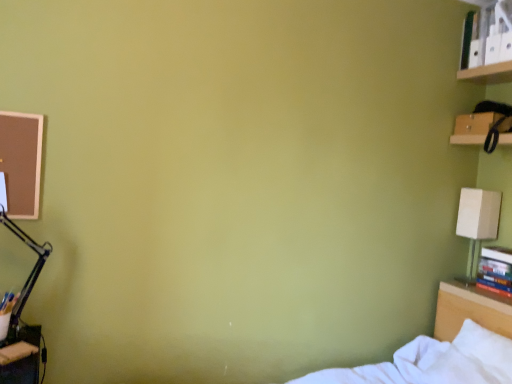
Question: Is white soft bed at lower right far away from wooden shelf at upper right?

Choices:
 (A) no
 (B) yes

Answer: (B)

Question: Can wooden shelf at upper right be found inside white soft bed at lower right?

Choices:
 (A) no
 (B) yes

Answer: (A)

Question: Is white soft bed at lower right next to wooden shelf at upper right and touching it?

Choices:
 (A) yes
 (B) no

Answer: (B)

Question: Can you confirm if white soft bed at lower right is wider than wooden shelf at upper right?

Choices:
 (A) no
 (B) yes

Answer: (B)

Question: From the image's perspective, is white soft bed at lower right beneath wooden shelf at upper right?

Choices:
 (A) yes
 (B) no

Answer: (A)

Question: Is white soft bed at lower right to the left of wooden shelf at upper right from the viewer's perspective?

Choices:
 (A) no
 (B) yes

Answer: (B)

Question: Considering the relative sizes of wooden desk at lower left and white soft bed at lower right in the image provided, is wooden desk at lower left thinner than white soft bed at lower right?

Choices:
 (A) no
 (B) yes

Answer: (B)

Question: From the image's perspective, is wooden desk at lower left on white soft bed at lower right?

Choices:
 (A) no
 (B) yes

Answer: (B)

Question: Can you confirm if wooden desk at lower left is positioned to the left of white soft bed at lower right?

Choices:
 (A) no
 (B) yes

Answer: (B)

Question: Does wooden desk at lower left have a greater width compared to white soft bed at lower right?

Choices:
 (A) yes
 (B) no

Answer: (B)

Question: From a real-world perspective, is wooden desk at lower left below white soft bed at lower right?

Choices:
 (A) no
 (B) yes

Answer: (A)

Question: From the image's perspective, is wooden desk at lower left under white soft bed at lower right?

Choices:
 (A) no
 (B) yes

Answer: (A)

Question: Is white cardboard book at upper right, marked as the second book in a bottom-to-top arrangement, further to the viewer compared to beige fabric lampshade at upper right?

Choices:
 (A) no
 (B) yes

Answer: (A)